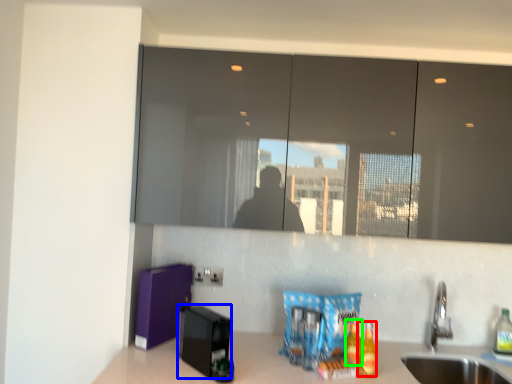
Question: Estimate the real-world distances between objects in this image. Which object is farther from beverage (highlighted by a red box), appliance (highlighted by a blue box) or beverage (highlighted by a green box)?

Choices:
 (A) appliance
 (B) beverage

Answer: (A)